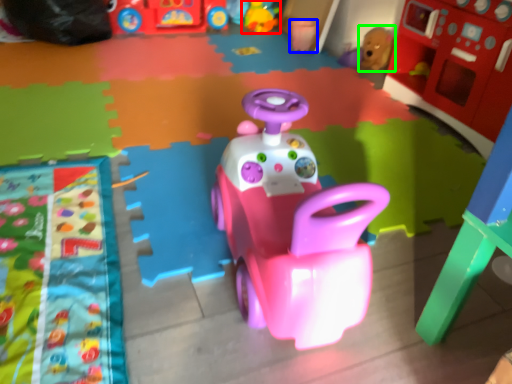
Question: Estimate the real-world distances between objects in this image. Which object is farther from toy (highlighted by a red box), toy (highlighted by a blue box) or toy (highlighted by a green box)?

Choices:
 (A) toy
 (B) toy

Answer: (B)